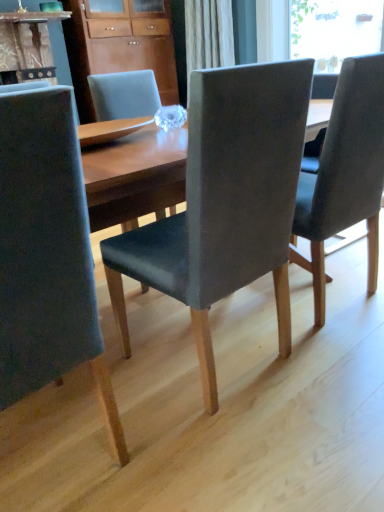
Question: In the image, is matte wood cabinet at upper center on the left side or the right side of transparent glass window at upper right?

Choices:
 (A) right
 (B) left

Answer: (B)

Question: From the image's perspective, is matte wood cabinet at upper center positioned above or below transparent glass window at upper right?

Choices:
 (A) below
 (B) above

Answer: (A)

Question: Estimate the real-world distances between objects in this image. Which object is closer to the matte wood cabinet at upper center?

Choices:
 (A) matte gray chair at left, which appears as the third chair when viewed from the right
 (B) dark gray fabric chair at center, acting as the third chair starting from the left
 (C) transparent glass window at upper right
 (D) matte gray chair at center, acting as the second chair starting from the left

Answer: (C)

Question: Estimate the real-world distances between objects in this image. Which object is farther from the dark gray fabric chair at center, acting as the third chair starting from the left?

Choices:
 (A) transparent glass window at upper right
 (B) matte wood cabinet at upper center
 (C) matte gray chair at center, acting as the second chair starting from the left
 (D) matte gray chair at left, which appears as the third chair when viewed from the right

Answer: (A)